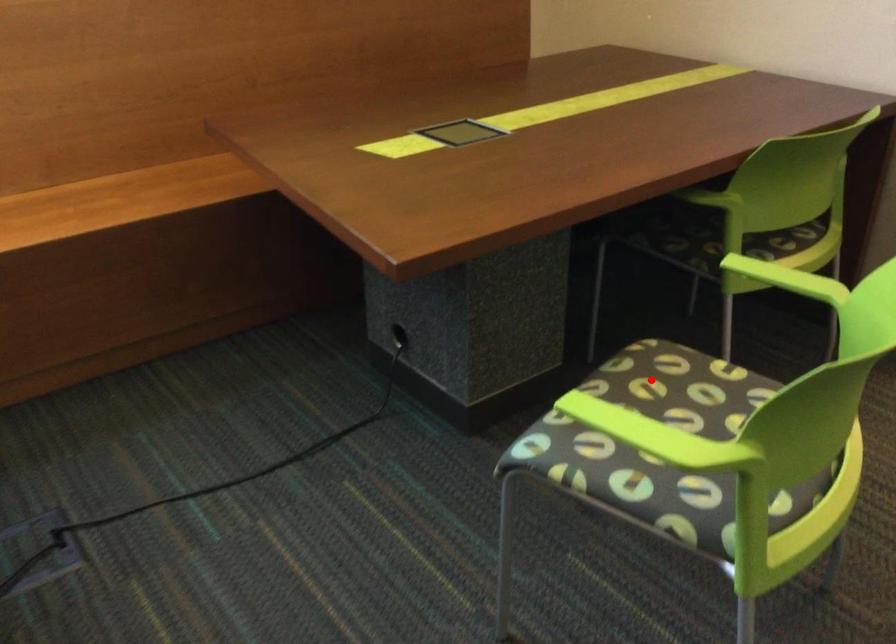
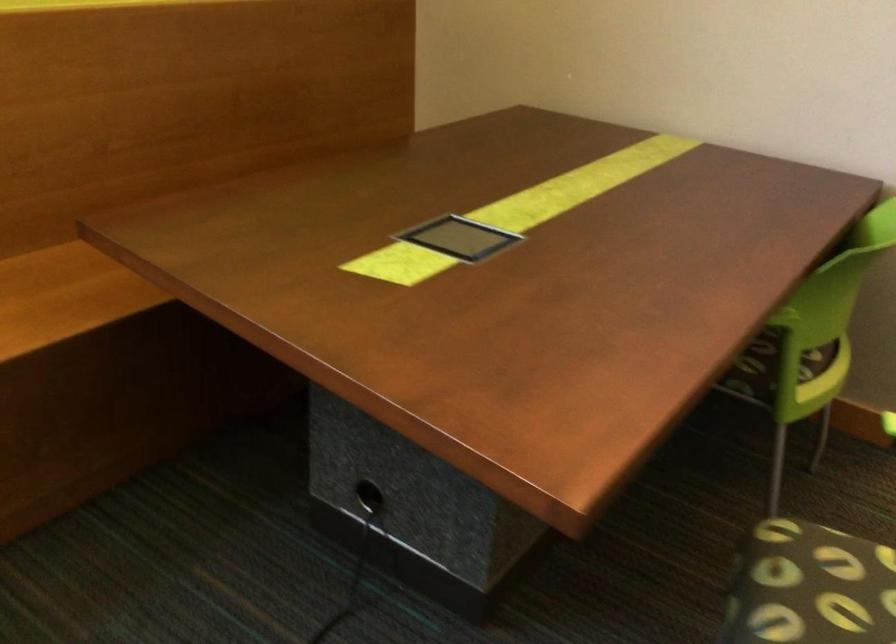
In the second image, find the point that corresponds to the highlighted location in the first image.

(815, 587)